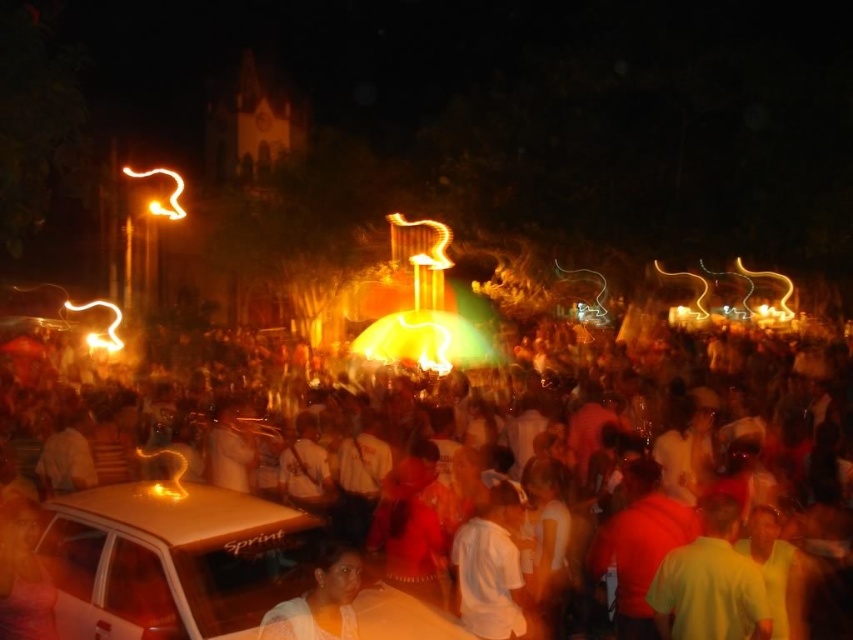
Who is lower down, matte orange crowd at center or shiny gold car at lower left?

shiny gold car at lower left is lower down.

Identify the location of matte orange crowd at center. This screenshot has height=640, width=853. (160, 552).

Is point (666, 509) positioned in front of point (282, 536)?

No, it is behind (282, 536).

This screenshot has width=853, height=640. I want to click on matte orange crowd at center, so click(160, 552).

Is point (619, 547) less distant than point (329, 625)?

No, (619, 547) is behind (329, 625).

Consider the image. Is matte orange crowd at center shorter than smooth skin face at lower center?

No, matte orange crowd at center is not shorter than smooth skin face at lower center.

I want to click on matte orange crowd at center, so click(x=160, y=552).

Find the location of a particular element. matte orange crowd at center is located at coordinates (160, 552).

Does shiny gold car at lower left have a larger size compared to smooth skin face at lower center?

Indeed, shiny gold car at lower left has a larger size compared to smooth skin face at lower center.

Does shiny gold car at lower left have a smaller size compared to smooth skin face at lower center?

No.

Which is behind, point (271, 589) or point (347, 588)?

The point (347, 588) is behind.

Locate an element on the screen. This screenshot has height=640, width=853. shiny gold car at lower left is located at coordinates (170, 561).